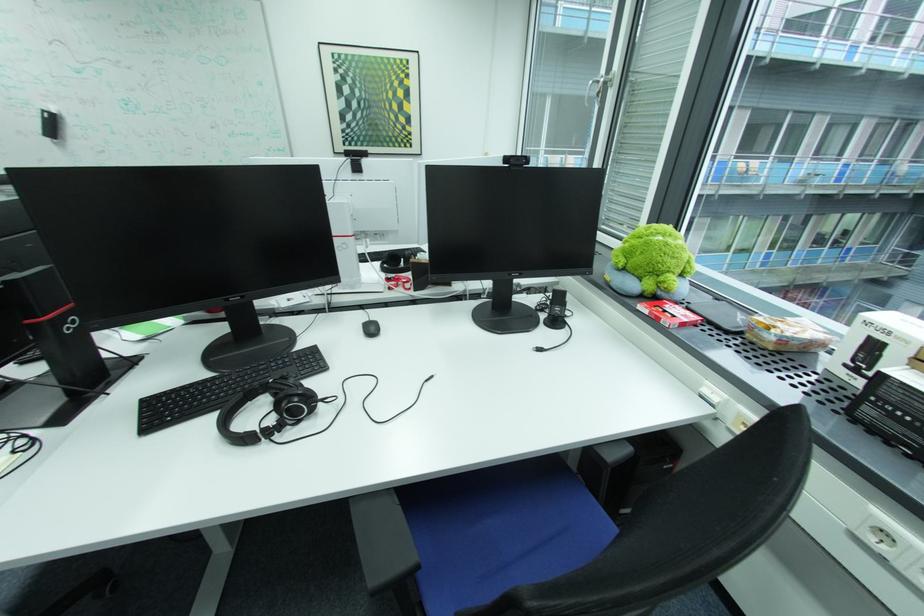
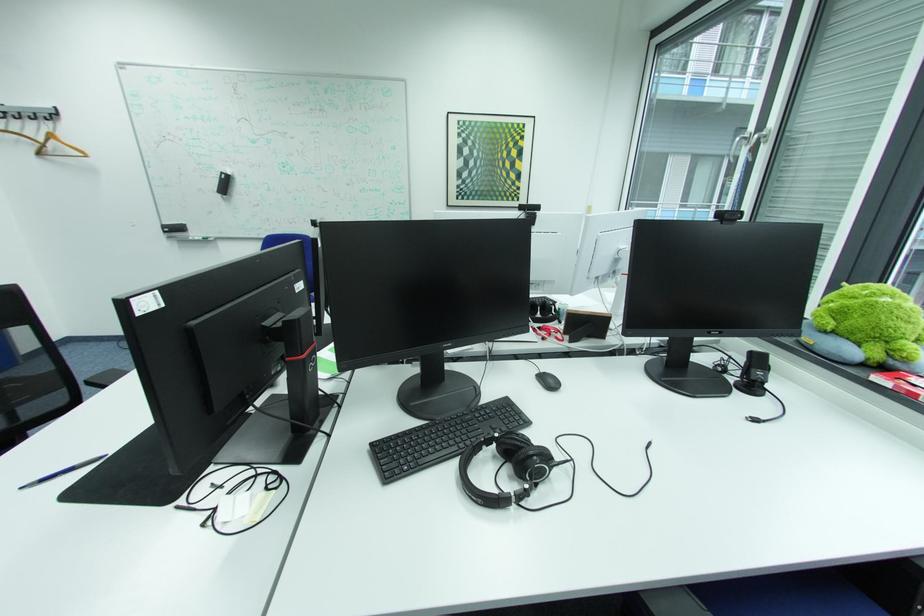
Locate, in the second image, the point that corresponds to (x=659, y=297) in the first image.

(882, 365)